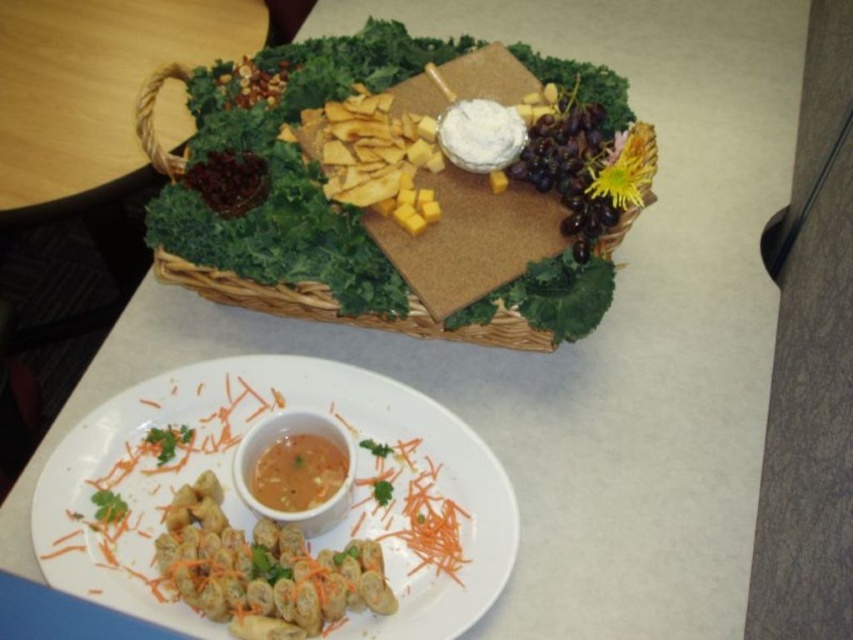
Question: Is white ceramic plate at lower center smaller than matte orange dip at center?

Choices:
 (A) yes
 (B) no

Answer: (B)

Question: Can you confirm if savory brown roll at center is wider than matte orange dip at center?

Choices:
 (A) no
 (B) yes

Answer: (B)

Question: Which point is closer to the camera?

Choices:
 (A) (248, 381)
 (B) (228, 529)

Answer: (B)

Question: Considering the real-world distances, which object is farthest from the smooth orange sauce at center?

Choices:
 (A) matte orange dip at center
 (B) savory brown roll at center

Answer: (B)

Question: Is woven brown basket at upper center wider than smooth orange sauce at center?

Choices:
 (A) yes
 (B) no

Answer: (A)

Question: Which point is farther to the camera?

Choices:
 (A) woven brown basket at upper center
 (B) savory brown roll at center
 (C) white ceramic plate at lower center
 (D) matte orange dip at center

Answer: (A)